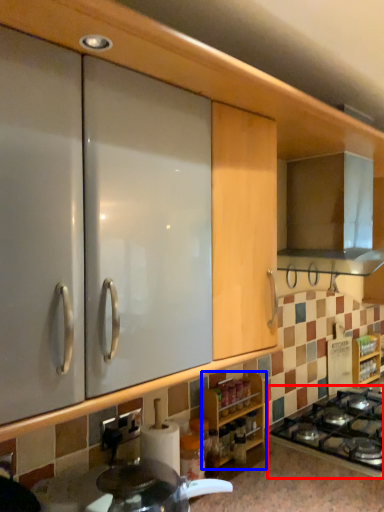
Question: Which point is further to the camera, gas stove (highlighted by a red box) or cabinetry (highlighted by a blue box)?

Choices:
 (A) gas stove
 (B) cabinetry

Answer: (B)